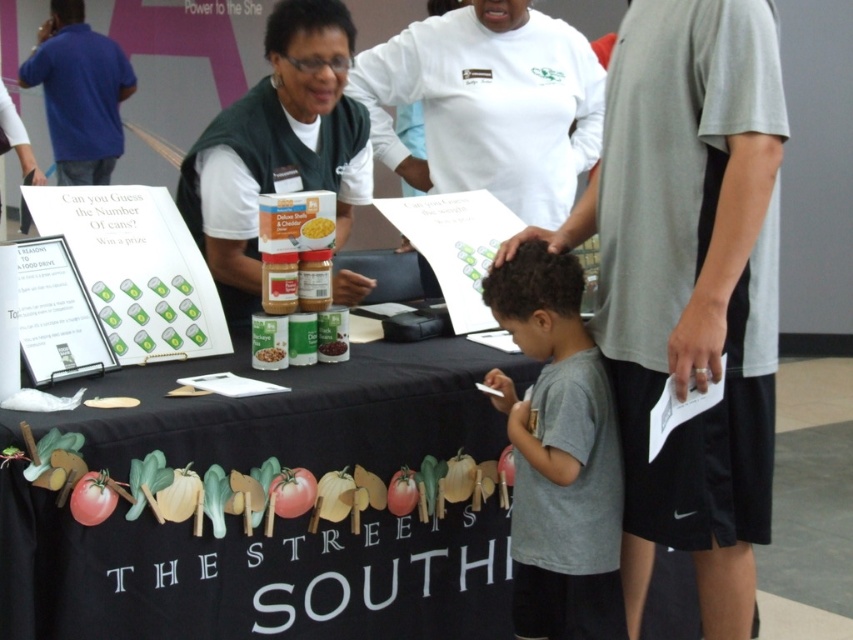
From the picture: You are a participant at the fair trying to guess the number of cans. You notice a matte green vest at center and a matte plastic can at center. Which object is positioned higher up?

The matte green vest at center is located above the matte plastic can at center, so it is positioned higher up.

You are a participant at the fair and you see the matte green vest at center and the matte plastic can at center. Which object is closer to you?

The matte green vest at center is closer to you because the matte plastic can at center is behind it.